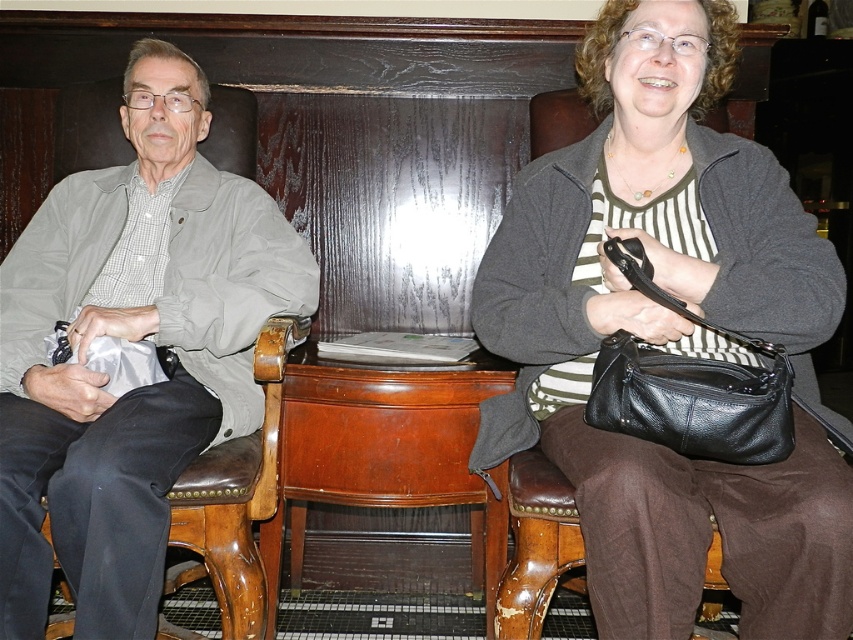
Question: Can you confirm if matte black purse at right is wider than brown leather stool at lower right?

Choices:
 (A) no
 (B) yes

Answer: (B)

Question: Which point is farther from the camera taking this photo?

Choices:
 (A) [224, 353]
 (B) [769, 609]

Answer: (A)

Question: Which point is closer to the camera?

Choices:
 (A) (564, 483)
 (B) (608, 168)

Answer: (A)

Question: From the image, what is the correct spatial relationship of matte black purse at right in relation to brown leather stool at lower right?

Choices:
 (A) above
 (B) below

Answer: (A)

Question: Observing the image, what is the correct spatial positioning of matte black purse at right in reference to matte gray jacket at left?

Choices:
 (A) above
 (B) below

Answer: (A)

Question: Which of the following is the closest to the observer?

Choices:
 (A) (639, 144)
 (B) (282, 259)

Answer: (A)